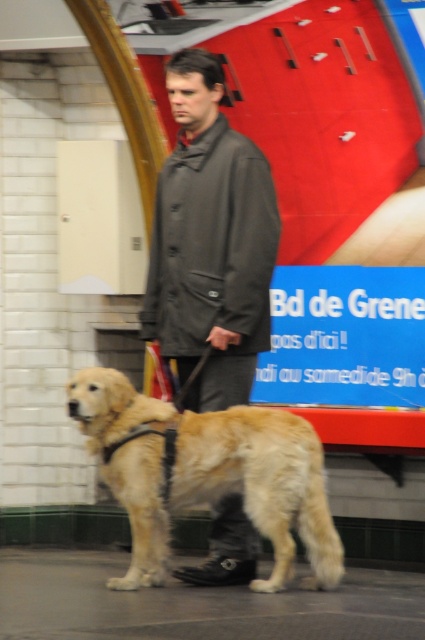
Question: Is dark gray coat at center bigger than golden fur dog at center?

Choices:
 (A) yes
 (B) no

Answer: (B)

Question: Among these objects, which one is farthest from the camera?

Choices:
 (A) golden fur dog at center
 (B) dark gray coat at center
 (C) blue plastic sign at center

Answer: (C)

Question: Which of the following is the farthest from the observer?

Choices:
 (A) golden fur dog at center
 (B) dark gray coat at center
 (C) blue plastic sign at center

Answer: (C)

Question: Which object is the closest to the dark gray coat at center?

Choices:
 (A) golden fur dog at center
 (B) blue plastic sign at center

Answer: (B)

Question: Observing the image, what is the correct spatial positioning of dark gray coat at center in reference to blue plastic sign at center?

Choices:
 (A) right
 (B) left

Answer: (B)

Question: Does dark gray coat at center appear under golden fur dog at center?

Choices:
 (A) no
 (B) yes

Answer: (A)